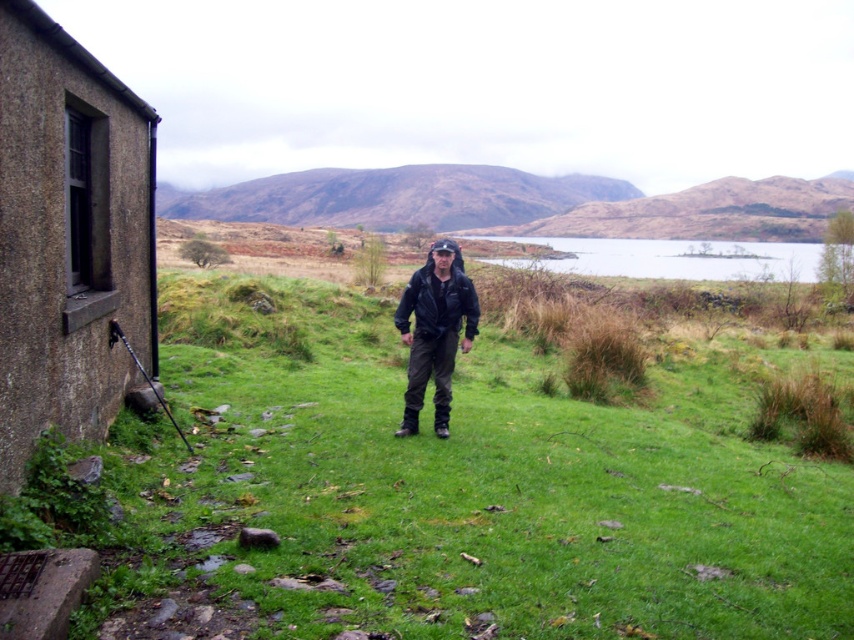
Question: Does green grassy at center have a smaller size compared to clear water at center?

Choices:
 (A) no
 (B) yes

Answer: (B)

Question: Considering the relative positions of brown textured stone hut at left and clear water at center in the image provided, where is brown textured stone hut at left located with respect to clear water at center?

Choices:
 (A) left
 (B) right

Answer: (A)

Question: Which point is farther to the camera?

Choices:
 (A) brown textured stone hut at left
 (B) black leather jacket at center

Answer: (B)

Question: Which point is closer to the camera taking this photo?

Choices:
 (A) (803, 257)
 (B) (188, 429)

Answer: (B)

Question: Considering the relative positions of brown textured stone hut at left and black leather jacket at center in the image provided, where is brown textured stone hut at left located with respect to black leather jacket at center?

Choices:
 (A) right
 (B) left

Answer: (B)

Question: Estimate the real-world distances between objects in this image. Which object is closer to the clear water at center?

Choices:
 (A) brown textured stone hut at left
 (B) green grassy at center
 (C) black leather jacket at center

Answer: (B)